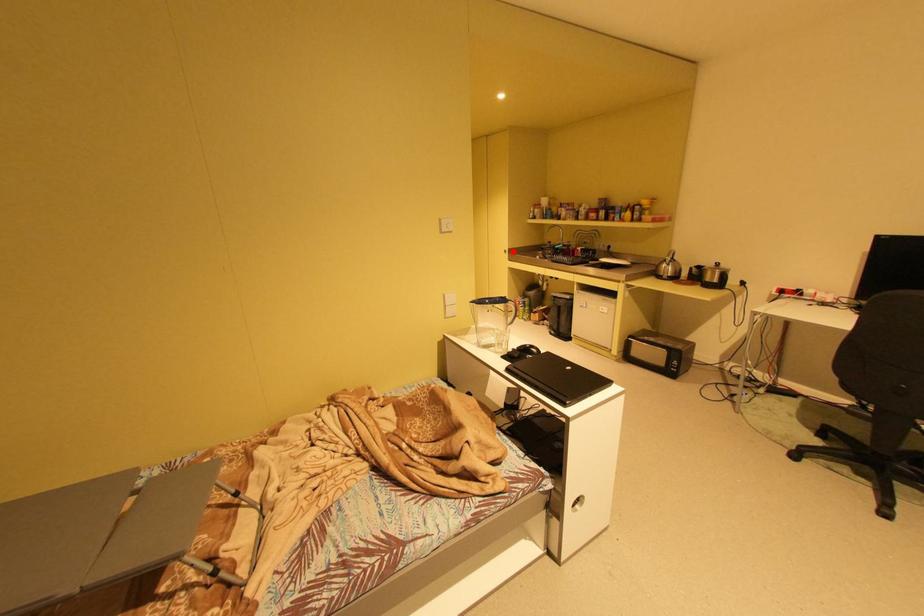
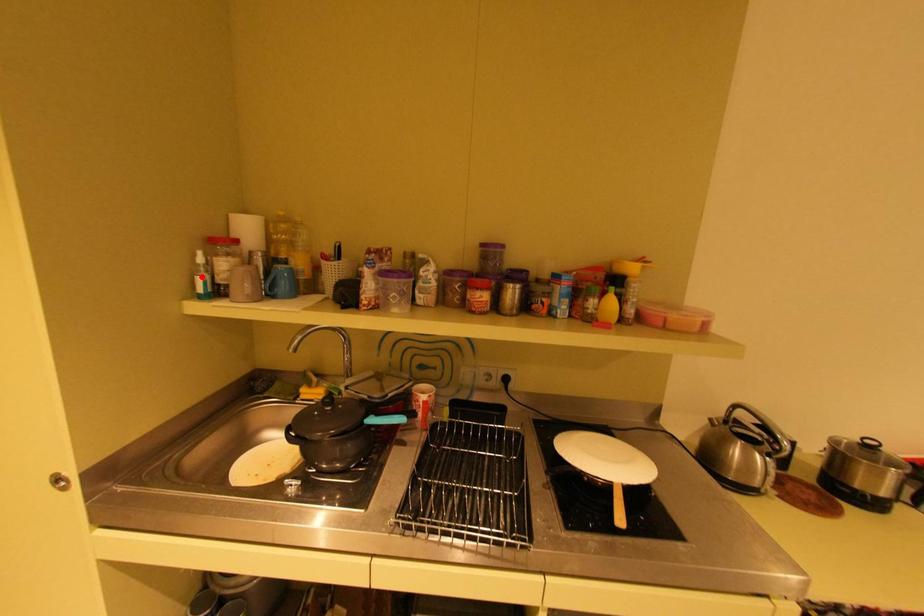
I am providing you with two images of the same scene from different viewpoints. A red point is marked on the first image and another point is marked on the second image. Are the points marked in image1 and image2 representing the same 3D position?

No